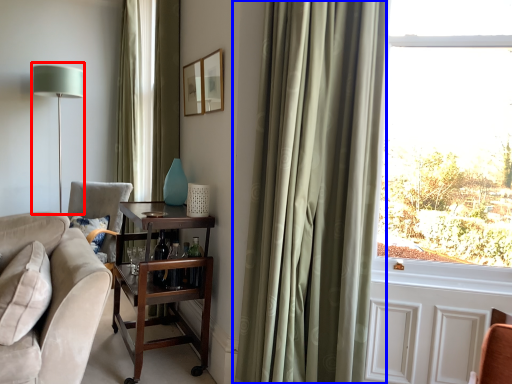
Question: Which of the following is the farthest to the observer, table lamp (highlighted by a red box) or curtain (highlighted by a blue box)?

Choices:
 (A) table lamp
 (B) curtain

Answer: (A)